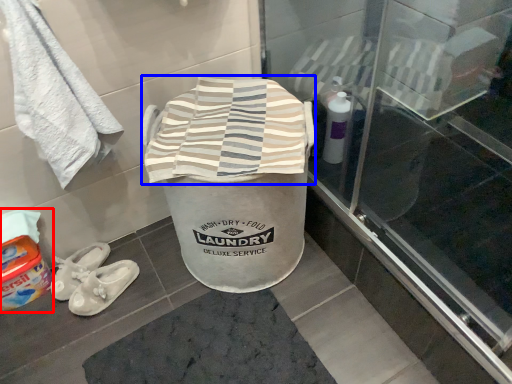
Question: Which point is closer to the camera, wash (highlighted by a red box) or beach towel (highlighted by a blue box)?

Choices:
 (A) wash
 (B) beach towel

Answer: (B)